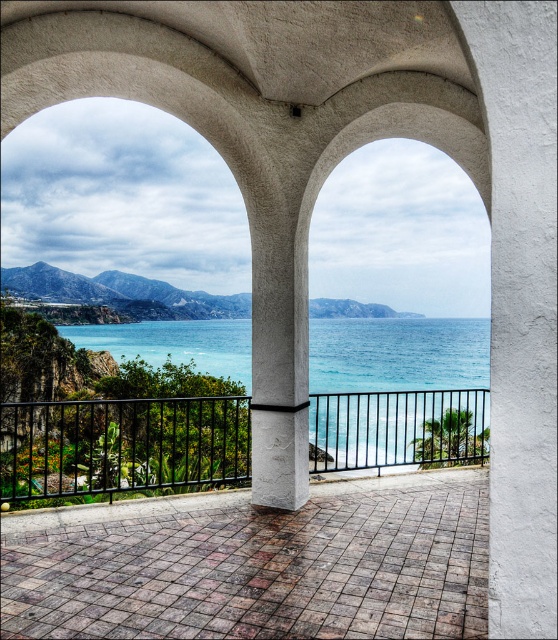
Question: Can you confirm if white stucco pillar at center is positioned above blue water at center?

Choices:
 (A) yes
 (B) no

Answer: (A)

Question: Among these objects, which one is farthest from the camera?

Choices:
 (A) white stucco pillar at center
 (B) blue water at center

Answer: (B)

Question: Considering the real-world distances, which object is farthest from the white stucco pillar at center?

Choices:
 (A) black metal/rail at center
 (B) blue water at center

Answer: (B)

Question: Is white stucco pillar at center above blue water at center?

Choices:
 (A) no
 (B) yes

Answer: (B)

Question: Which object is positioned farthest from the black metal/rail at center?

Choices:
 (A) blue water at center
 (B) white stucco pillar at center

Answer: (A)

Question: Can you confirm if white stucco pillar at center is bigger than blue water at center?

Choices:
 (A) no
 (B) yes

Answer: (A)